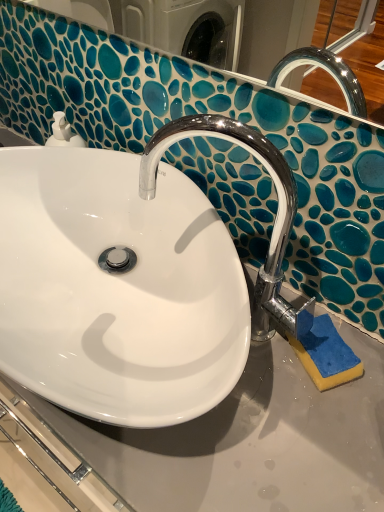
Question: From the image's perspective, relative to white glossy sink at center, is blue sponge at lower right above or below?

Choices:
 (A) above
 (B) below

Answer: (B)

Question: Is point (301, 358) positioned closer to the camera than point (54, 231)?

Choices:
 (A) farther
 (B) closer

Answer: (B)

Question: Which object is the closest to the blue sponge at lower right?

Choices:
 (A) white glossy sink at center
 (B) chrome/metallic faucet at center

Answer: (B)

Question: Which is farther from the white glossy sink at center?

Choices:
 (A) blue sponge at lower right
 (B) chrome/metallic faucet at center

Answer: (A)